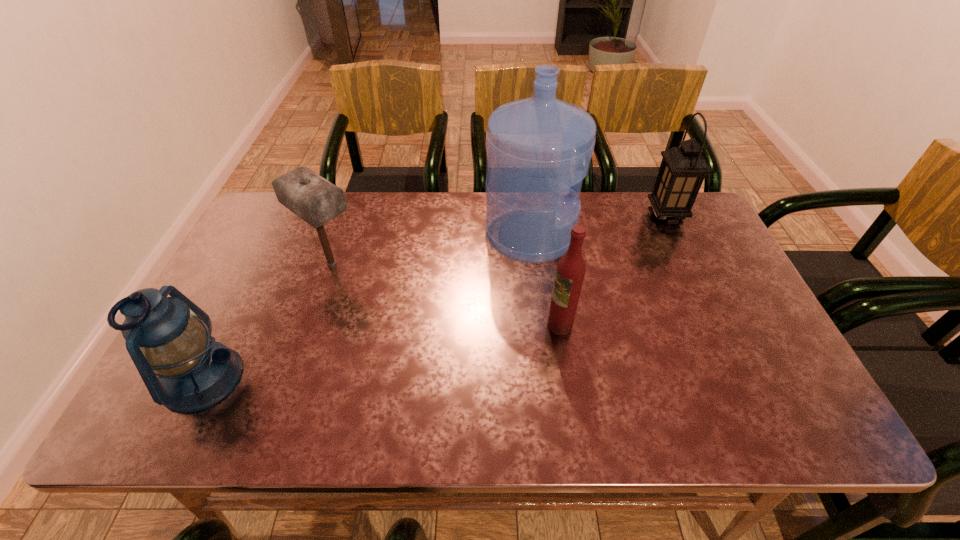
You are a GUI agent. You are given a task and a screenshot of the screen. Output one action in this format:
    pyautogui.click(x=<x>, y=<y>)
    Task: Click on the free space located on the label of the liquor
    The width and height of the screenshot is (960, 540).
    Given the screenshot: What is the action you would take?
    pyautogui.click(x=423, y=325)

Where is `vacant space situated 0.100m on the label of the liquor`? This screenshot has width=960, height=540. vacant space situated 0.100m on the label of the liquor is located at coordinates (507, 325).

Identify the location of vacant area located 0.130m on the label of the liquor. The width and height of the screenshot is (960, 540). (495, 325).

The image size is (960, 540). In order to click on vacant space situated 0.090m on the face of the nearer lantern in this screenshot , I will do `click(281, 379)`.

Locate an element on the screen. The image size is (960, 540). water jug positioned at the far edge is located at coordinates (539, 149).

You are a GUI agent. You are given a task and a screenshot of the screen. Output one action in this format:
    pyautogui.click(x=<x>, y=<y>)
    Task: Click on the lantern that is at the far edge
    Image resolution: width=960 pixels, height=540 pixels.
    Given the screenshot: What is the action you would take?
    coord(683,169)

Where is `object that is at the near edge`? The height and width of the screenshot is (540, 960). object that is at the near edge is located at coordinates (195, 372).

Image resolution: width=960 pixels, height=540 pixels. In order to click on object present at the left edge in this screenshot , I will do `click(195, 372)`.

Locate an element on the screen. The image size is (960, 540). object positioned at the right edge is located at coordinates (683, 169).

Where is `object that is at the near left corner`? object that is at the near left corner is located at coordinates (195, 372).